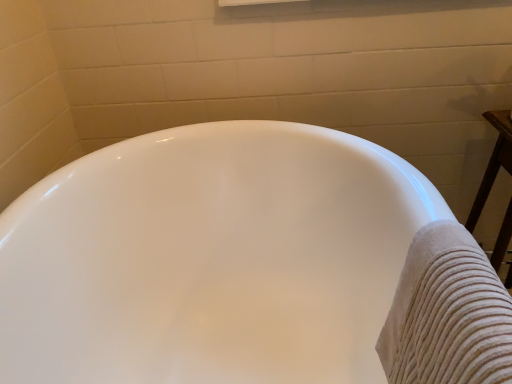
Question: In the image, is beige textured towel at right positioned in front of or behind white glossy bathtub at center?

Choices:
 (A) behind
 (B) front

Answer: (B)

Question: Is point (430, 292) closer or farther from the camera than point (315, 193)?

Choices:
 (A) closer
 (B) farther

Answer: (A)

Question: From the image's perspective, is beige textured towel at right above or below white glossy bathtub at center?

Choices:
 (A) below
 (B) above

Answer: (B)

Question: Would you say white glossy bathtub at center is to the left or to the right of beige textured towel at right in the picture?

Choices:
 (A) left
 (B) right

Answer: (A)

Question: Considering the positions of white glossy bathtub at center and beige textured towel at right in the image, is white glossy bathtub at center wider or thinner than beige textured towel at right?

Choices:
 (A) wide
 (B) thin

Answer: (A)

Question: Choose the correct answer: Is white glossy bathtub at center inside beige textured towel at right or outside it?

Choices:
 (A) outside
 (B) inside

Answer: (A)

Question: In terms of height, does white glossy bathtub at center look taller or shorter compared to beige textured towel at right?

Choices:
 (A) short
 (B) tall

Answer: (B)